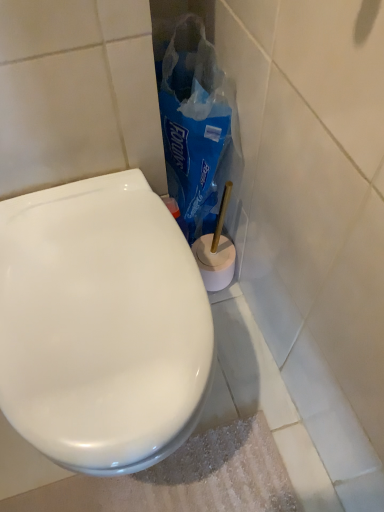
Question: From the image's perspective, is blue plastic bag at center positioned above or below white glossy toilet seat at center?

Choices:
 (A) above
 (B) below

Answer: (A)

Question: Based on their positions, is blue plastic bag at center located to the left or right of white glossy toilet seat at center?

Choices:
 (A) left
 (B) right

Answer: (B)

Question: Is blue plastic bag at center bigger or smaller than white glossy toilet seat at center?

Choices:
 (A) big
 (B) small

Answer: (B)

Question: Based on their positions, is white glossy toilet seat at center located to the left or right of blue plastic bag at center?

Choices:
 (A) left
 (B) right

Answer: (A)

Question: Is white glossy toilet seat at center inside or outside of blue plastic bag at center?

Choices:
 (A) inside
 (B) outside

Answer: (B)

Question: From the image's perspective, is white glossy toilet seat at center located above or below blue plastic bag at center?

Choices:
 (A) above
 (B) below

Answer: (B)

Question: From a real-world perspective, is white glossy toilet seat at center physically located above or below blue plastic bag at center?

Choices:
 (A) above
 (B) below

Answer: (B)